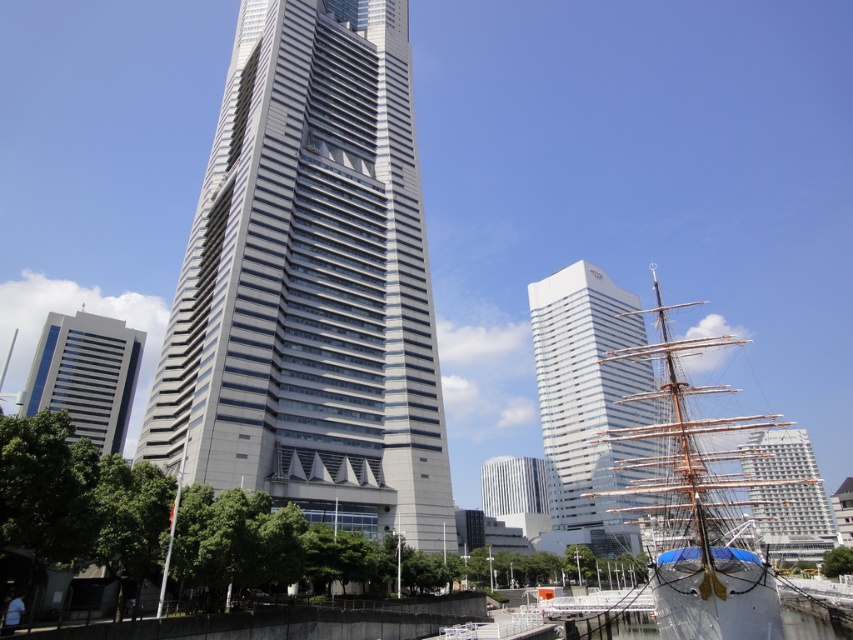
Question: Can you confirm if gray glass skyscraper at center is thinner than white textured building at right?

Choices:
 (A) yes
 (B) no

Answer: (A)

Question: Among these points, which one is farthest from the camera?

Choices:
 (A) (666, 612)
 (B) (169, 540)
 (C) (790, 476)

Answer: (C)

Question: Does white glossy building at center appear on the left side of polished wood mast at lower left?

Choices:
 (A) yes
 (B) no

Answer: (B)

Question: Among these objects, which one is nearest to the camera?

Choices:
 (A) polished wood mast at lower left
 (B) gray glass skyscraper at center

Answer: (A)

Question: Is white glass tower at center further to the viewer compared to blue glass skyscraper at left?

Choices:
 (A) yes
 (B) no

Answer: (B)

Question: Which of the following is the closest to the observer?

Choices:
 (A) (181, 458)
 (B) (283, 456)
 (C) (140, 353)
 (D) (801, 532)

Answer: (A)